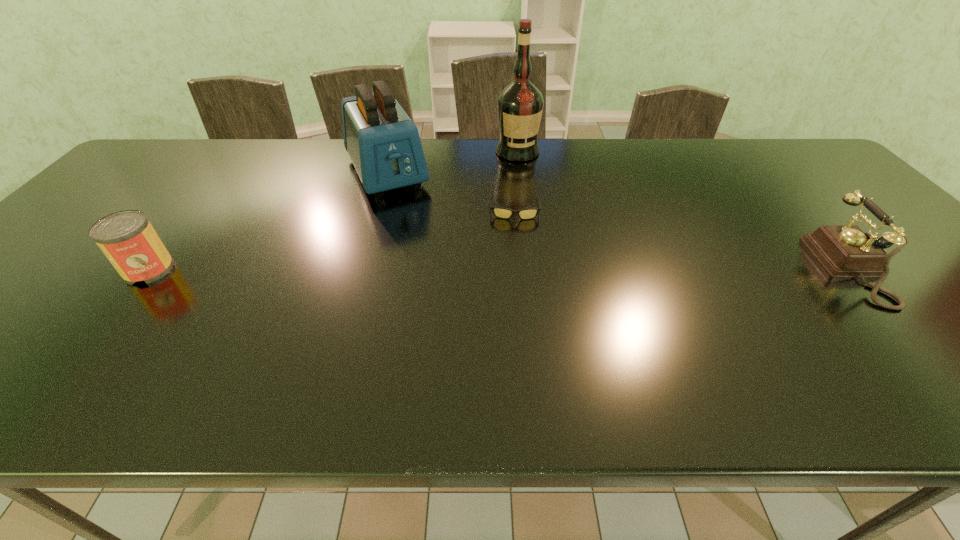
Locate an element on the screen. The height and width of the screenshot is (540, 960). the leftmost object is located at coordinates (128, 240).

The image size is (960, 540). I want to click on the rightmost object, so click(x=844, y=251).

In order to click on the fourth object from right to left in this screenshot , I will do `click(384, 145)`.

I want to click on the fourth shortest object, so click(384, 145).

Find the location of a particular element. Image resolution: width=960 pixels, height=540 pixels. the tallest object is located at coordinates (520, 104).

Locate an element on the screen. The width and height of the screenshot is (960, 540). sunglasses is located at coordinates (504, 213).

Where is `vacant space located on the back of the leftmost object`? The height and width of the screenshot is (540, 960). vacant space located on the back of the leftmost object is located at coordinates (213, 188).

Identify the location of vacant space located 0.060m on the dial of the rightmost object. (921, 269).

This screenshot has width=960, height=540. In order to click on vacant space located on the front-facing side of the toaster in this screenshot , I will do `click(425, 249)`.

Where is `vacant space situated on the front-facing side of the toaster`? This screenshot has height=540, width=960. vacant space situated on the front-facing side of the toaster is located at coordinates (408, 219).